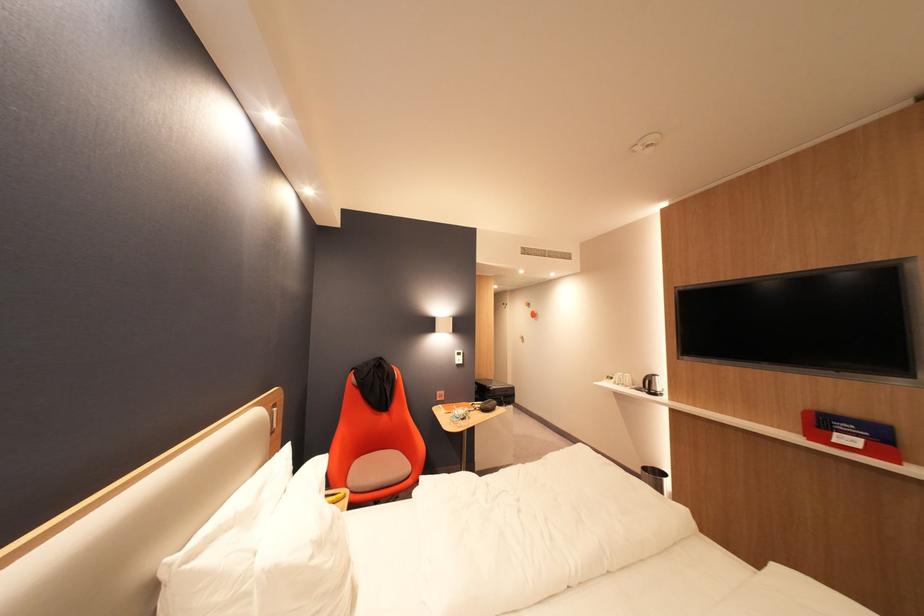
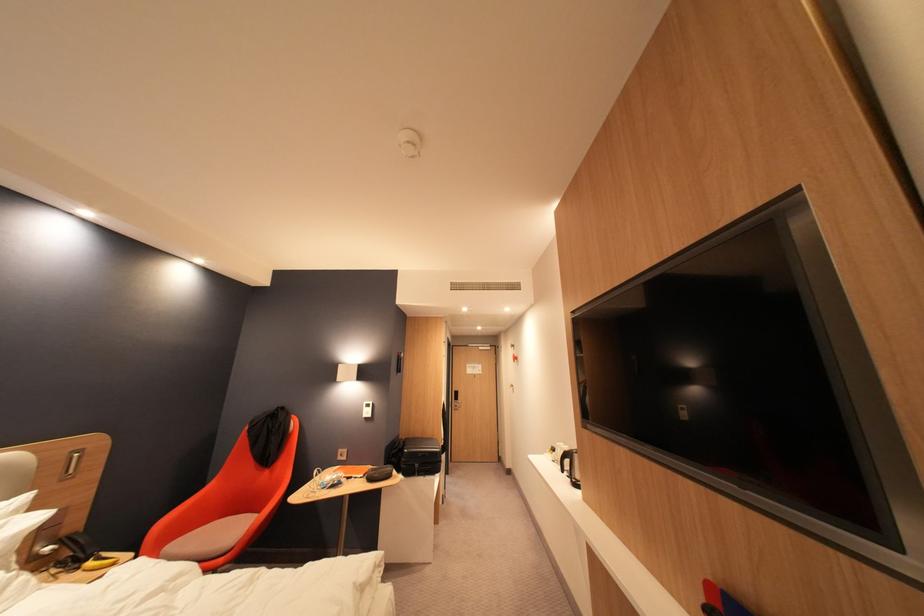
In the second image, find the point that corresponds to pixel 483 411 in the first image.

(371, 477)